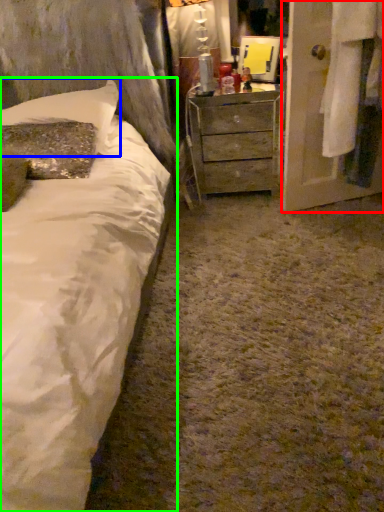
Question: Which is nearer to the armoire (highlighted by a red box)? pillow (highlighted by a blue box) or bed (highlighted by a green box).

Choices:
 (A) pillow
 (B) bed

Answer: (A)